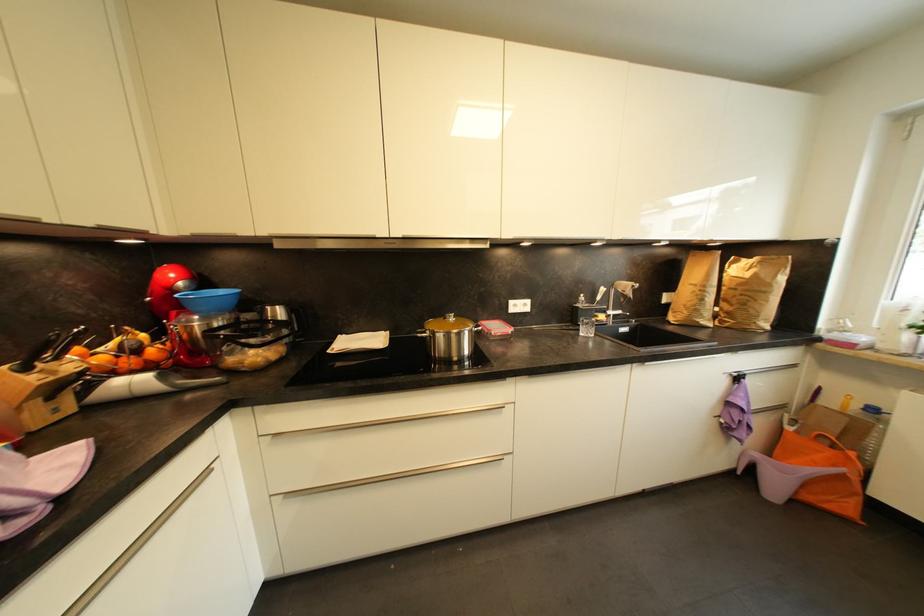
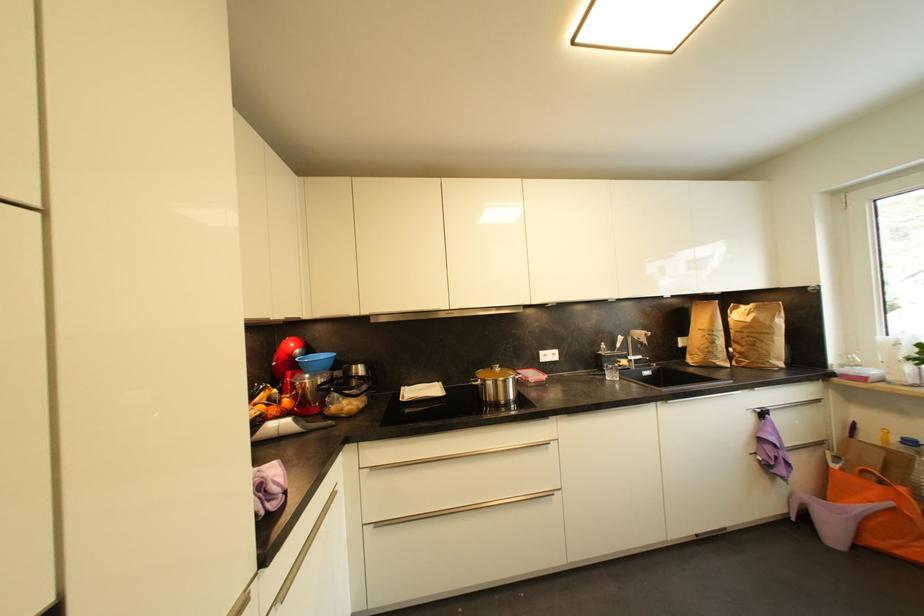
The point at (707, 302) is marked in the first image. Where is the corresponding point in the second image?

(718, 345)